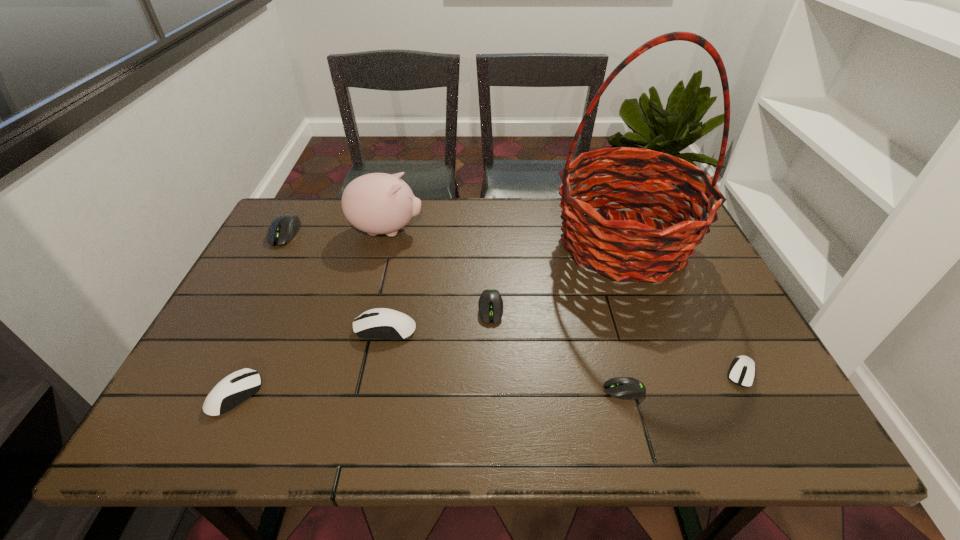
Point out which computer mouse is positioned as the second nearest to the second smallest gray computer mouse. Please provide its 2D coordinates. Your answer should be formatted as a tuple, i.e. [(x, y)], where the tuple contains the x and y coordinates of a point satisfying the conditions above.

[(627, 388)]

What are the coordinates of `white mouse that is the second closest to the farthest white mouse` in the screenshot? It's located at (742, 371).

You are a GUI agent. You are given a task and a screenshot of the screen. Output one action in this format:
    pyautogui.click(x=<x>, y=<y>)
    Task: Click on the white mouse that is the nearest to the second biggest white mouse
    Image resolution: width=960 pixels, height=540 pixels.
    Given the screenshot: What is the action you would take?
    pyautogui.click(x=381, y=323)

Locate an element on the screen. The image size is (960, 540). gray computer mouse object that ranks as the closest to the farthest gray computer mouse is located at coordinates (490, 304).

Point out which gray computer mouse is positioned as the nearest to the third computer mouse from left to right. Please provide its 2D coordinates. Your answer should be formatted as a tuple, i.e. [(x, y)], where the tuple contains the x and y coordinates of a point satisfying the conditions above.

[(490, 304)]

Where is `vacant space that satisfies the following two spatial constraints: 1. on the wheel side of the farthest gray computer mouse; 2. on the left side of the second smallest white mouse`? vacant space that satisfies the following two spatial constraints: 1. on the wheel side of the farthest gray computer mouse; 2. on the left side of the second smallest white mouse is located at coordinates (199, 395).

Locate an element on the screen. The image size is (960, 540). free spot that satisfies the following two spatial constraints: 1. on the wheel side of the biggest gray computer mouse; 2. on the right side of the smallest white mouse is located at coordinates (210, 373).

Where is `free space that satisfies the following two spatial constraints: 1. at the snout of the piggy bank; 2. on the wheel side of the leftmost gray computer mouse`? The width and height of the screenshot is (960, 540). free space that satisfies the following two spatial constraints: 1. at the snout of the piggy bank; 2. on the wheel side of the leftmost gray computer mouse is located at coordinates (386, 233).

I want to click on free location that satisfies the following two spatial constraints: 1. on the back side of the farthest white mouse; 2. at the snout of the piggy bank, so click(x=405, y=231).